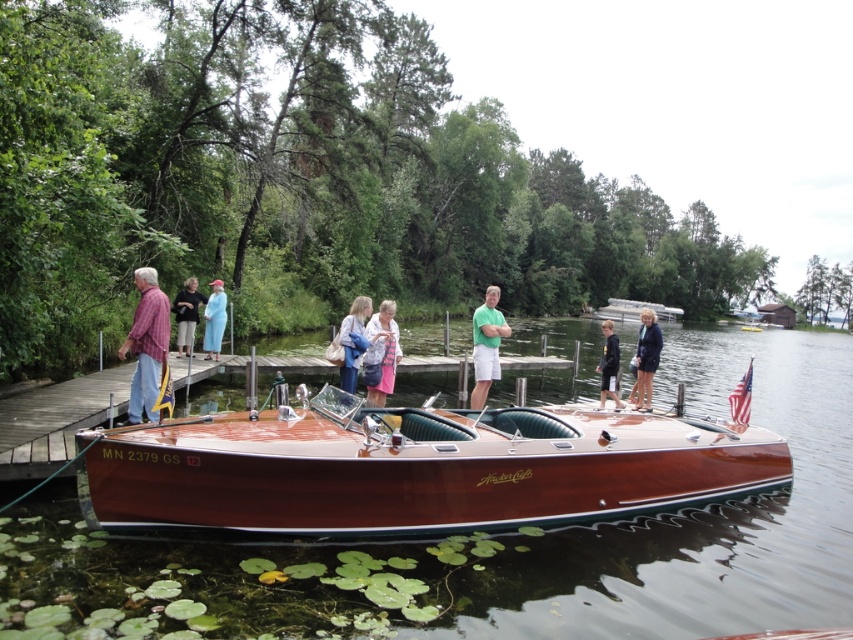
Question: Which object appears farthest from the camera in this image?

Choices:
 (A) glossy wood boat at center
 (B) green matte shirt at center
 (C) light pink fabric at center
 (D) matte red shirt at left

Answer: (B)

Question: Which of the following is the farthest from the observer?

Choices:
 (A) wooden boat at center
 (B) blue fabric dress at center

Answer: (B)

Question: Estimate the real-world distances between objects in this image. Which object is farther from the black cotton jacket at center?

Choices:
 (A) green matte shirt at center
 (B) light pink fabric at center
 (C) glossy wood boat at center

Answer: (C)

Question: Is light blue denim jacket at center thinner than blue fabric dress at center?

Choices:
 (A) yes
 (B) no

Answer: (B)

Question: In this image, where is dark blue fabric coat at center located relative to black cotton jacket at center?

Choices:
 (A) right
 (B) left

Answer: (B)

Question: Does matte red shirt at left have a smaller size compared to light pink fabric at center?

Choices:
 (A) no
 (B) yes

Answer: (B)